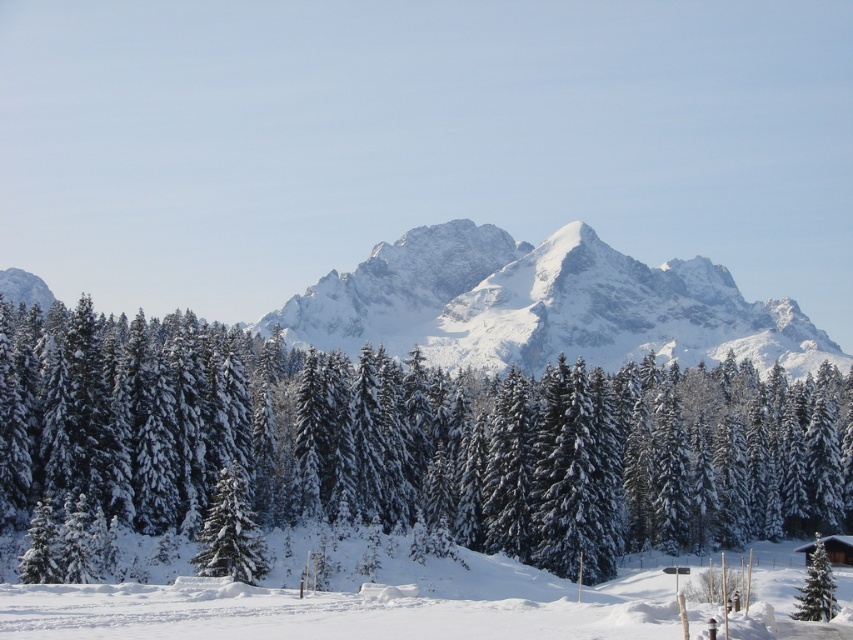
The height and width of the screenshot is (640, 853). What do you see at coordinates (407, 444) in the screenshot?
I see `snow-covered evergreen at center` at bounding box center [407, 444].

Does point (47, 417) come in front of point (213, 502)?

That is False.

Is point (369, 429) behind point (202, 564)?

Yes.

Where is `snow-covered evergreen at center`? snow-covered evergreen at center is located at coordinates (407, 444).

Does snow-covered evergreen at center have a larger size compared to white snow ski slope at lower center?

Correct, snow-covered evergreen at center is larger in size than white snow ski slope at lower center.

Does snow-covered evergreen at center appear on the right side of white snow ski slope at lower center?

No, snow-covered evergreen at center is not to the right of white snow ski slope at lower center.

Describe the element at coordinates (407, 444) in the screenshot. Image resolution: width=853 pixels, height=640 pixels. I see `snow-covered evergreen at center` at that location.

Identify the location of snow-covered evergreen at center. (407, 444).

Does snow-covered evergreen at center appear over white snow-covered mountain at center?

No.

Does snow-covered evergreen at center appear on the left side of white snow-covered mountain at center?

Correct, you'll find snow-covered evergreen at center to the left of white snow-covered mountain at center.

Is point (631, 465) closer to viewer compared to point (711, 296)?

Yes.

The height and width of the screenshot is (640, 853). What are the coordinates of `snow-covered evergreen at center` in the screenshot? It's located at (407, 444).